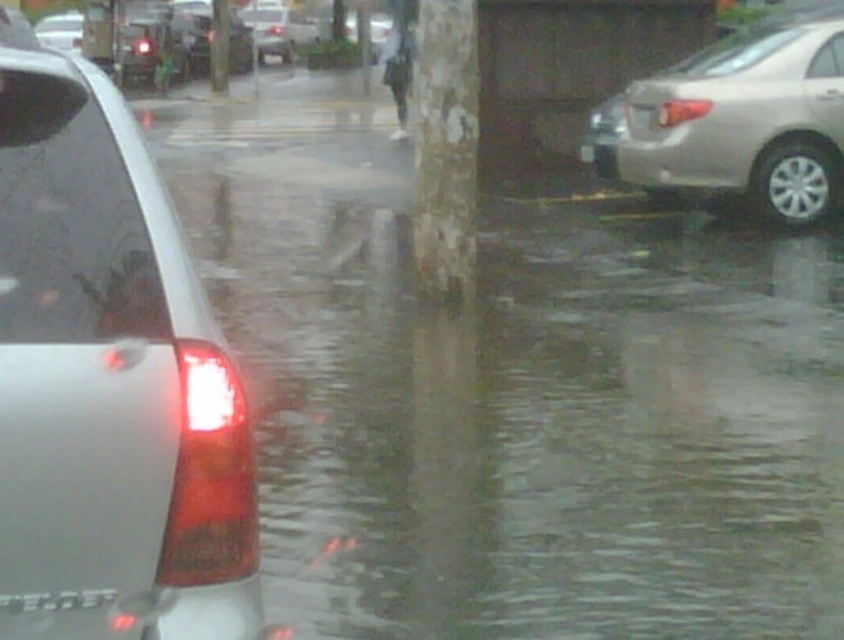
Question: Which point is closer to the camera taking this photo?

Choices:
 (A) (279, 36)
 (B) (179, 16)

Answer: (B)

Question: Which point appears closest to the camera in this image?

Choices:
 (A) (41, 636)
 (B) (669, 129)

Answer: (A)

Question: Can you confirm if satin silver car at left is wider than metallic silver sedan at upper left?

Choices:
 (A) yes
 (B) no

Answer: (B)

Question: Does metallic silver sedan at upper left have a greater width compared to silver metallic sedan at center?

Choices:
 (A) yes
 (B) no

Answer: (B)

Question: Estimate the real-world distances between objects in this image. Which object is farther from the matte black car at left?

Choices:
 (A) metallic silver sedan at upper left
 (B) white plastic license plate at center
 (C) satin beige sedan at right
 (D) silver metallic sedan at center

Answer: (C)

Question: From the image, what is the correct spatial relationship of satin silver car at left in relation to metallic silver sedan at upper left?

Choices:
 (A) above
 (B) below

Answer: (B)